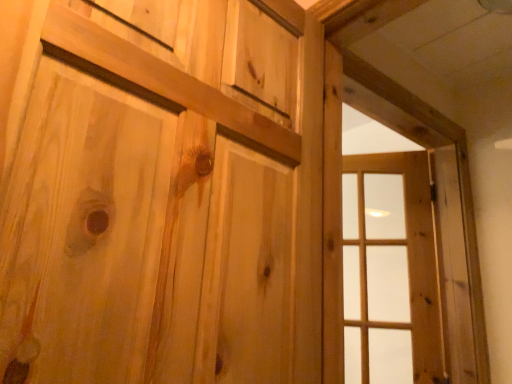
Question: Is natural wood window frame at right positioned beyond the bounds of clear glass window at right?

Choices:
 (A) no
 (B) yes

Answer: (B)

Question: Does natural wood window frame at right have a greater width compared to clear glass window at right?

Choices:
 (A) no
 (B) yes

Answer: (A)

Question: Is natural wood window frame at right facing away from clear glass window at right?

Choices:
 (A) no
 (B) yes

Answer: (B)

Question: From a real-world perspective, does natural wood window frame at right sit lower than clear glass window at right?

Choices:
 (A) yes
 (B) no

Answer: (B)

Question: From the image's perspective, is natural wood window frame at right above clear glass window at right?

Choices:
 (A) no
 (B) yes

Answer: (B)

Question: From the image's perspective, is clear glass window at right positioned above or below natural wood door at center?

Choices:
 (A) above
 (B) below

Answer: (B)

Question: Considering the positions of clear glass window at right and natural wood door at center in the image, is clear glass window at right bigger or smaller than natural wood door at center?

Choices:
 (A) big
 (B) small

Answer: (B)

Question: In terms of height, does clear glass window at right look taller or shorter compared to natural wood door at center?

Choices:
 (A) tall
 (B) short

Answer: (A)

Question: Is clear glass window at right inside the boundaries of natural wood door at center, or outside?

Choices:
 (A) outside
 (B) inside

Answer: (A)

Question: Considering the positions of natural wood window frame at right and natural wood door at center in the image, is natural wood window frame at right bigger or smaller than natural wood door at center?

Choices:
 (A) big
 (B) small

Answer: (B)

Question: From the image's perspective, is natural wood window frame at right positioned above or below natural wood door at center?

Choices:
 (A) above
 (B) below

Answer: (B)

Question: Does point (437, 170) appear closer or farther from the camera than point (307, 226)?

Choices:
 (A) farther
 (B) closer

Answer: (A)

Question: Is natural wood window frame at right to the left or to the right of natural wood door at center in the image?

Choices:
 (A) right
 (B) left

Answer: (A)

Question: From a real-world perspective, is natural wood window frame at right above or below clear glass window at right?

Choices:
 (A) below
 (B) above

Answer: (B)

Question: Would you say natural wood window frame at right is to the left or to the right of clear glass window at right in the picture?

Choices:
 (A) left
 (B) right

Answer: (A)